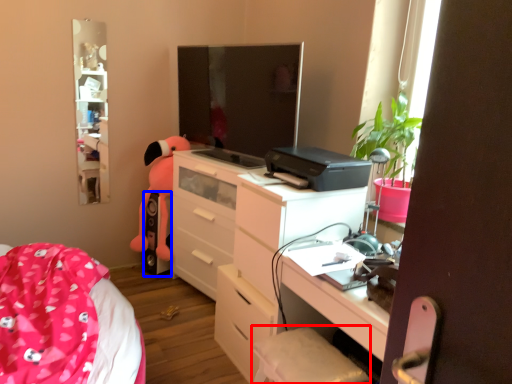
Question: Among these objects, which one is farthest to the camera, swivel chair (highlighted by a red box) or speaker (highlighted by a blue box)?

Choices:
 (A) swivel chair
 (B) speaker

Answer: (B)